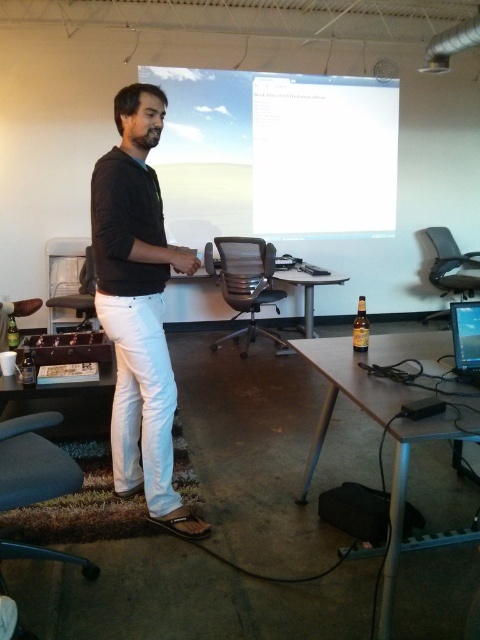
You are in a room and need to locate the white glossy projection screen at upper center and the matte black swivel chair at center. From the perspective of someone facing the front of the room, which object is positioned to the right?

The white glossy projection screen at upper center is positioned to the right of the matte black swivel chair at center.

You are sitting at the brown wood table at lower left and want to look at the white glossy projection screen at upper center. In which direction should you turn your head?

You should turn your head to the right to look at the white glossy projection screen at upper center since it is located to the right of the brown wood table at lower left.

You are standing in the room and want to walk from the white glossy projection screen at upper center to the metallic silver table at lower right. Which direction should you move in?

You should move downward and to the right, as the metallic silver table at lower right is positioned below and to the right of the white glossy projection screen at upper center.